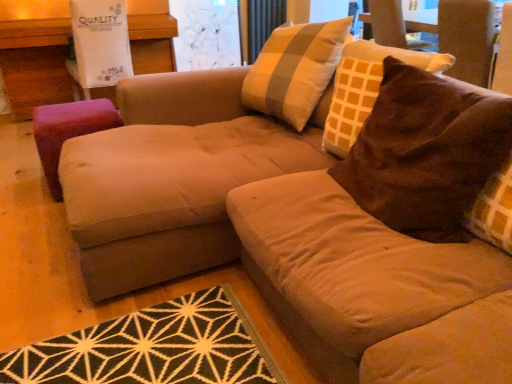
Where is `brown suede pillow at upper right`? brown suede pillow at upper right is located at coordinates (425, 153).

Identify the location of brown suede swivel chair at upper right. (467, 38).

Describe the element at coordinates (263, 23) in the screenshot. I see `orange fabric curtain at upper center` at that location.

Where is `brown suede pillow at upper right`? This screenshot has height=384, width=512. brown suede pillow at upper right is located at coordinates (425, 153).

From the image's perspective, is orange fabric curtain at upper center positioned above or below purple fabric ottoman at left?

Clearly, from the image's perspective, orange fabric curtain at upper center is above purple fabric ottoman at left.

Is point (268, 32) positioned behind point (6, 46)?

Yes, it is.

Considering the sizes of orange fabric curtain at upper center and purple fabric ottoman at left in the image, is orange fabric curtain at upper center taller or shorter than purple fabric ottoman at left?

Considering their sizes, orange fabric curtain at upper center has less height than purple fabric ottoman at left.

Considering the sizes of objects orange fabric curtain at upper center and purple fabric ottoman at left in the image provided, who is wider, orange fabric curtain at upper center or purple fabric ottoman at left?

With larger width is purple fabric ottoman at left.

Identify the location of swivel chair lying on the right of purple fabric ottoman at left. (467, 38).

Considering the positions of points (32, 90) and (457, 68), is point (32, 90) closer to camera compared to point (457, 68)?

No, it is behind (457, 68).

How many degrees apart are the facing directions of purple fabric ottoman at left and brown suede swivel chair at upper right?

purple fabric ottoman at left and brown suede swivel chair at upper right are facing 88.5 degrees away from each other.

Is purple fabric ottoman at left in front of brown suede swivel chair at upper right?

No, the depth of purple fabric ottoman at left is greater than that of brown suede swivel chair at upper right.

Who is taller, purple fabric ottoman at left or orange fabric curtain at upper center?

purple fabric ottoman at left.

Is purple fabric ottoman at left spatially inside orange fabric curtain at upper center, or outside of it?

purple fabric ottoman at left exists outside the volume of orange fabric curtain at upper center.

Could you tell me if purple fabric ottoman at left is turned towards orange fabric curtain at upper center?

No, purple fabric ottoman at left is not oriented towards orange fabric curtain at upper center.

Is point (165, 14) closer or farther from the camera than point (262, 30)?

Point (165, 14) is closer to the camera than point (262, 30).

Consider the image. Would you say brown suede swivel chair at upper right is part of transparent glass screen door at upper center's contents?

Actually, brown suede swivel chair at upper right is outside transparent glass screen door at upper center.

Based on the photo, does transparent glass screen door at upper center have a greater height compared to brown suede swivel chair at upper right?

Yes, transparent glass screen door at upper center is taller than brown suede swivel chair at upper right.

From the image's perspective, is transparent glass screen door at upper center located beneath brown suede swivel chair at upper right?

No.

Is transparent glass screen door at upper center to the left of brown suede swivel chair at upper right from the viewer's perspective?

Indeed, transparent glass screen door at upper center is positioned on the left side of brown suede swivel chair at upper right.

Is brown suede pillow at upper right taller or shorter than brown suede swivel chair at upper right?

Considering their sizes, brown suede pillow at upper right has more height than brown suede swivel chair at upper right.

Is brown suede pillow at upper right looking in the opposite direction of brown suede swivel chair at upper right?

brown suede pillow at upper right is not turned away from brown suede swivel chair at upper right.

From the image's perspective, is brown suede pillow at upper right under brown suede swivel chair at upper right?

Correct, brown suede pillow at upper right appears lower than brown suede swivel chair at upper right in the image.

Locate an element on the screen. Image resolution: width=512 pixels, height=384 pixels. screen door on the right of purple fabric stool at left is located at coordinates (206, 34).

Is transparent glass screen door at upper center facing away from purple fabric stool at left?

No, transparent glass screen door at upper center is not facing the opposite direction of purple fabric stool at left.

Considering the relative sizes of transparent glass screen door at upper center and purple fabric stool at left in the image provided, is transparent glass screen door at upper center taller than purple fabric stool at left?

Yes.

Does transparent glass screen door at upper center lie behind purple fabric stool at left?

Yes, the depth of transparent glass screen door at upper center is greater than that of purple fabric stool at left.

Is purple fabric ottoman at left inside the boundaries of transparent glass screen door at upper center, or outside?

The correct answer is: outside.

Is purple fabric ottoman at left placed right next to transparent glass screen door at upper center?

No, purple fabric ottoman at left is not with transparent glass screen door at upper center.

Does purple fabric ottoman at left have a smaller size compared to transparent glass screen door at upper center?

Incorrect, purple fabric ottoman at left is not smaller in size than transparent glass screen door at upper center.

From the image's perspective, would you say purple fabric ottoman at left is positioned over transparent glass screen door at upper center?

No, from the image's perspective, purple fabric ottoman at left is not over transparent glass screen door at upper center.

At what (x,y) coordinates should I click in order to perform the action: click on table located in front of the orange fabric curtain at upper center. Please return your answer as a coordinate pair (x, y). Looking at the image, I should click on (35, 63).

Locate an element on the screen. The width and height of the screenshot is (512, 384). swivel chair lying on the right of purple fabric ottoman at left is located at coordinates (467, 38).

Considering their positions, is transparent glass screen door at upper center positioned further to purple fabric ottoman at left than orange fabric curtain at upper center?

orange fabric curtain at upper center is further to purple fabric ottoman at left.

Based on their spatial positions, is purple fabric ottoman at left or purple fabric stool at left closer to brown suede pillow at upper right?

purple fabric stool at left.

From the image, which object appears to be farther from transparent glass screen door at upper center, brown suede swivel chair at upper right or orange fabric curtain at upper center?

brown suede swivel chair at upper right lies further to transparent glass screen door at upper center than the other object.

When comparing their distances from brown suede pillow at upper right, does transparent glass screen door at upper center or purple fabric stool at left seem closer?

Based on the image, purple fabric stool at left appears to be nearer to brown suede pillow at upper right.

When comparing their distances from purple fabric stool at left, does orange fabric curtain at upper center or brown suede swivel chair at upper right seem further?

The object further to purple fabric stool at left is orange fabric curtain at upper center.

Looking at the image, which one is located further to purple fabric ottoman at left, orange fabric curtain at upper center or transparent glass screen door at upper center?

orange fabric curtain at upper center is positioned further to the anchor purple fabric ottoman at left.

Which object lies further to the anchor point orange fabric curtain at upper center, brown suede pillow at upper right or transparent glass screen door at upper center?

brown suede pillow at upper right is further to orange fabric curtain at upper center.

Based on their spatial positions, is transparent glass screen door at upper center or purple fabric stool at left further from brown suede swivel chair at upper right?

transparent glass screen door at upper center.

Where is `stool positioned between brown suede pillow at upper right and transparent glass screen door at upper center from near to far`? stool positioned between brown suede pillow at upper right and transparent glass screen door at upper center from near to far is located at coordinates (68, 131).

At what (x,y) coordinates should I click in order to perform the action: click on screen door between purple fabric stool at left and orange fabric curtain at upper center along the z-axis. Please return your answer as a coordinate pair (x, y). Looking at the image, I should click on (206, 34).

Image resolution: width=512 pixels, height=384 pixels. In order to click on table between brown suede pillow at upper right and transparent glass screen door at upper center from front to back in this screenshot , I will do `click(35, 63)`.

Locate an element on the screen. The width and height of the screenshot is (512, 384). screen door situated between purple fabric ottoman at left and brown suede swivel chair at upper right from left to right is located at coordinates (206, 34).